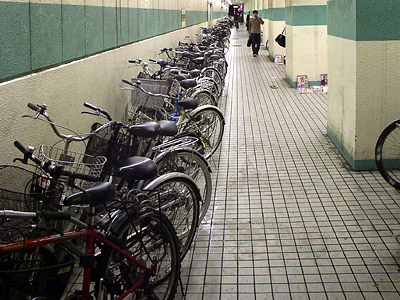
The image size is (400, 300). I want to click on wall on left, so click(62, 41).